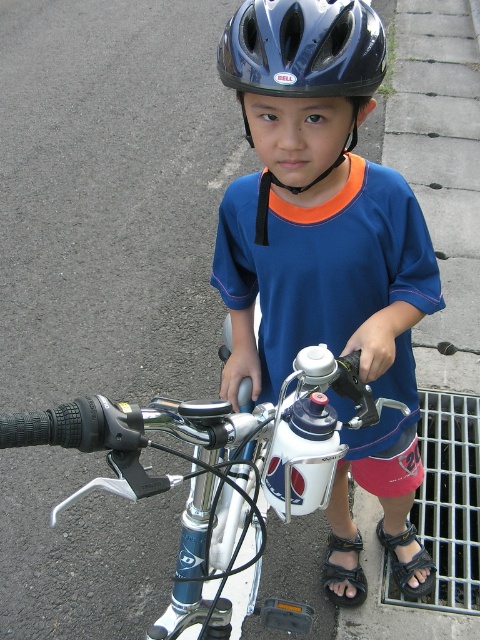
You are a delivery person who needs to place a small package on the ground near the black matte helmet at center. Based on the coordinates provided, where should you place the package relative to the helmet?

The package should be placed directly at the coordinates point (301,65) where the black matte helmet at center is located.

You are a safety inspector checking the helmets in the image. The blue matte helmet at upper center and the black matte helmet at center are both present. According to safety regulations, helmets must not exceed 12 inches in width. Can you determine if either helmet violates this regulation?

The blue matte helmet at upper center might be wider than black matte helmet at center, but without specific measurements, it is impossible to confirm if either exceeds the 12 inch width limit. Further measurement is required.